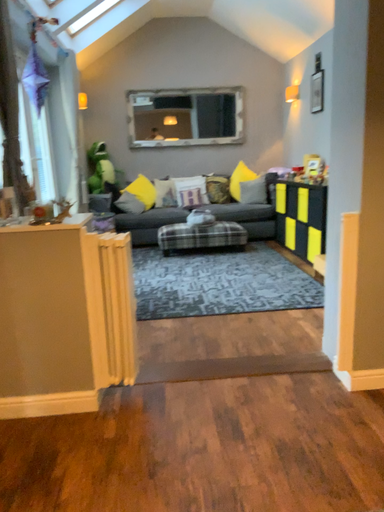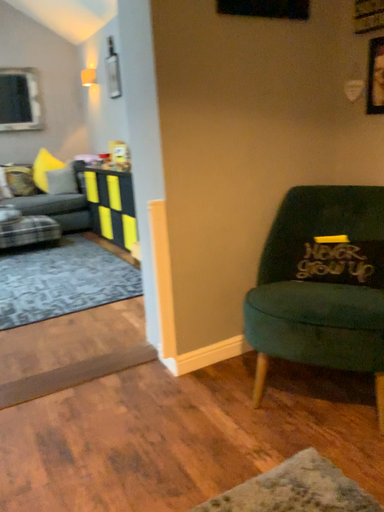
Question: How did the camera likely rotate when shooting the video?

Choices:
 (A) rotated left
 (B) rotated right

Answer: (B)